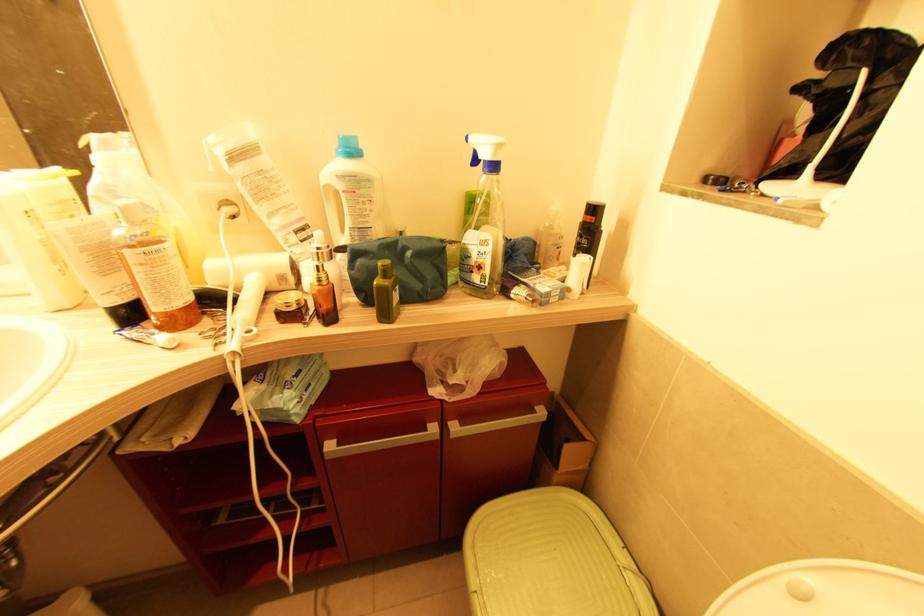
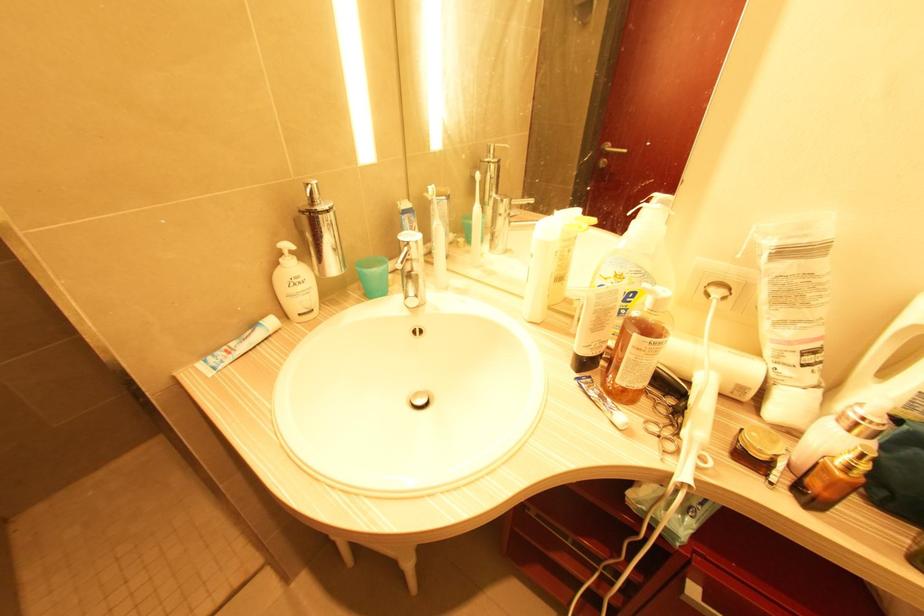
Question: The images are taken continuously from a first-person perspective. In which direction is your viewpoint rotating?

Choices:
 (A) Left
 (B) Right
 (C) Up
 (D) Down

Answer: (A)